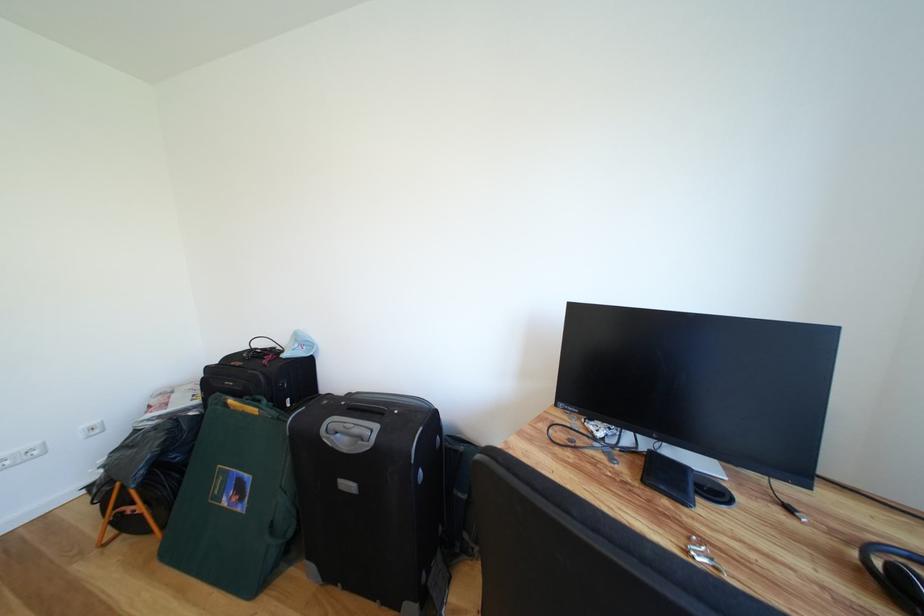
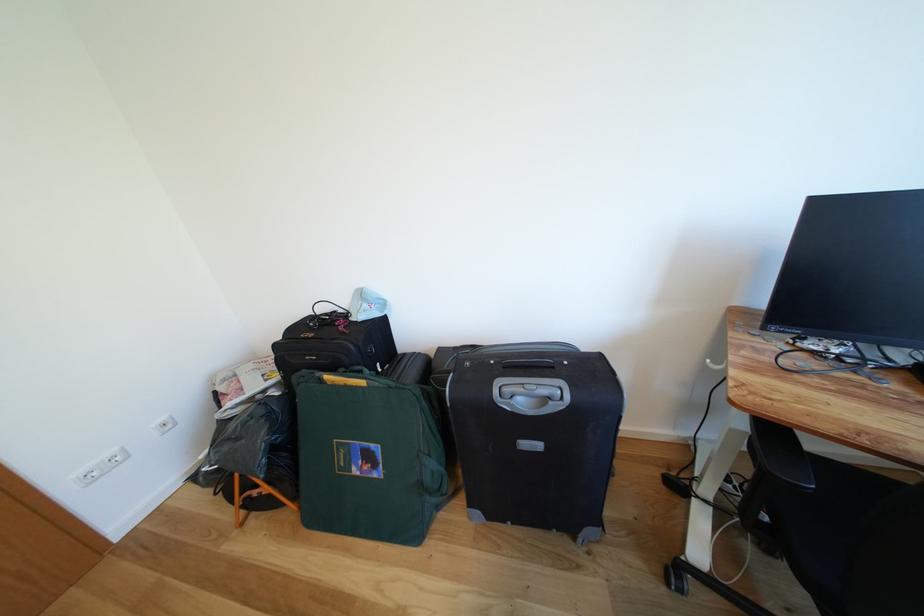
Which direction would the cameraman need to move to produce the second image?

The movement direction of the cameraman is left, forward.